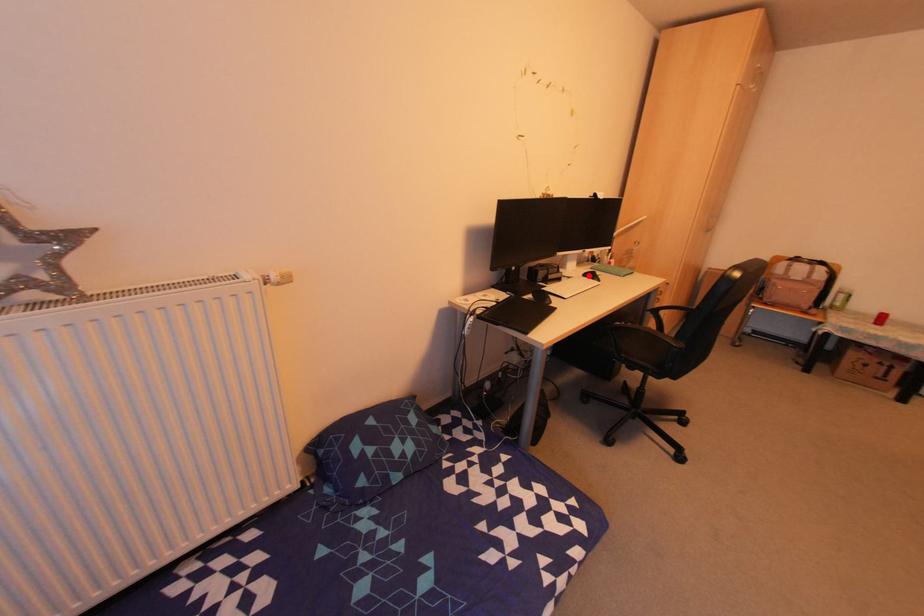
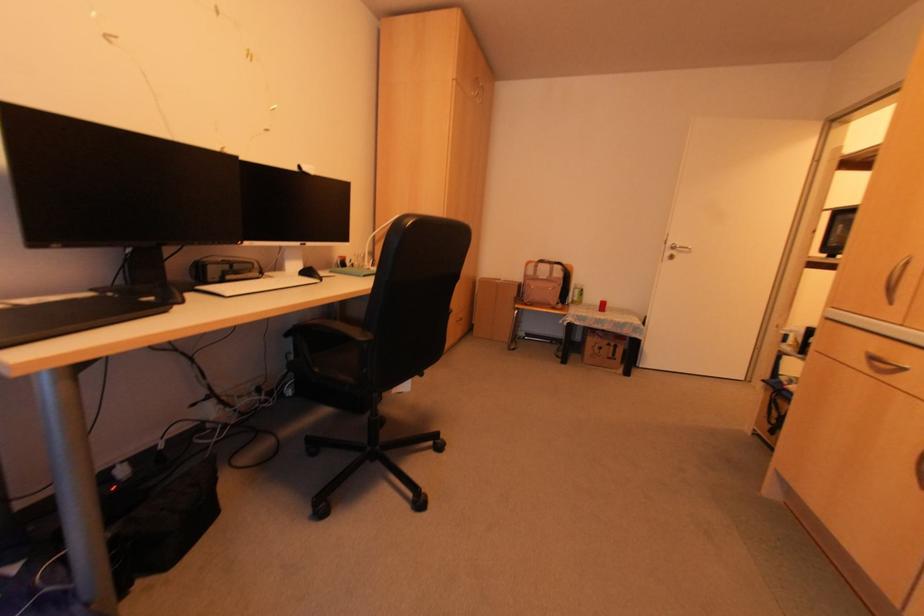
The point at the highlighted location is marked in the first image. Where is the corresponding point in the second image?

(305, 274)